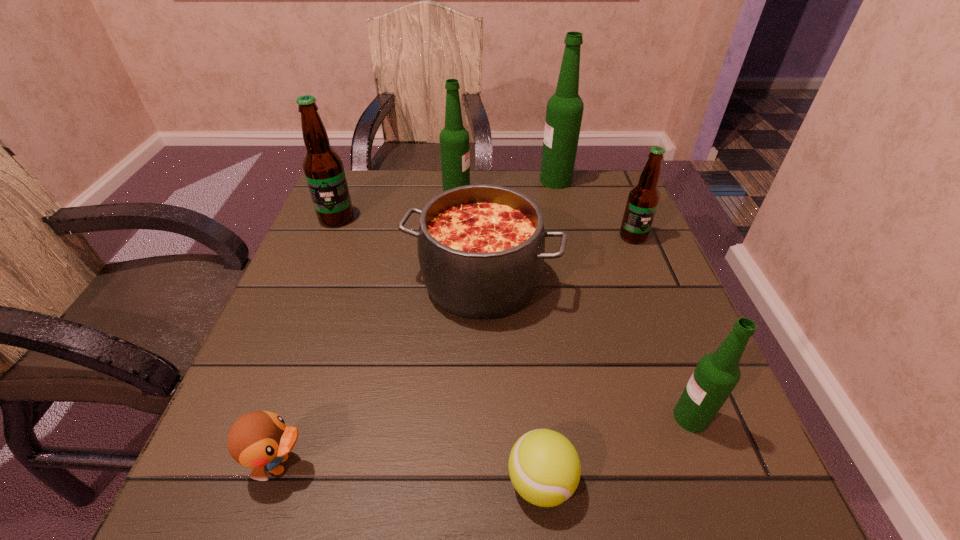
This screenshot has width=960, height=540. Find the location of `vacant space located 0.330m on the label of the third nearest object`. vacant space located 0.330m on the label of the third nearest object is located at coordinates (467, 417).

Image resolution: width=960 pixels, height=540 pixels. In order to click on blank space located 0.210m on the label of the third nearest object in this screenshot , I will do `click(542, 417)`.

The image size is (960, 540). Identify the location of vacant space located on the label of the third nearest object. (561, 417).

Find the location of a particular element. The width and height of the screenshot is (960, 540). free space located on the label of the smaller brown beer bottle is located at coordinates (660, 305).

You are a GUI agent. You are given a task and a screenshot of the screen. Output one action in this format:
    pyautogui.click(x=<x>, y=<y>)
    Task: Click on the vacant region located 0.330m on the back of the gray casserole
    This screenshot has width=960, height=540.
    Given the screenshot: What is the action you would take?
    pyautogui.click(x=481, y=173)

The height and width of the screenshot is (540, 960). Find the location of `vacant space located on the front-facing side of the seventh tallest object`. vacant space located on the front-facing side of the seventh tallest object is located at coordinates (558, 464).

You are a GUI agent. You are given a task and a screenshot of the screen. Output one action in this format:
    pyautogui.click(x=<x>, y=<y>)
    Task: Click on the free space located on the right of the tennis ball
    The height and width of the screenshot is (540, 960).
    Given the screenshot: What is the action you would take?
    pyautogui.click(x=743, y=482)

You are a GUI agent. You are given a task and a screenshot of the screen. Output one action in this format:
    pyautogui.click(x=<x>, y=<y>)
    Task: Click on the duck situated at the near edge
    The image size is (960, 540).
    Given the screenshot: What is the action you would take?
    pyautogui.click(x=260, y=440)

Image resolution: width=960 pixels, height=540 pixels. What are the coordinates of `tennis ball that is at the near edge` in the screenshot? It's located at (544, 467).

Where is `beer bottle that is at the left edge`? This screenshot has height=540, width=960. beer bottle that is at the left edge is located at coordinates (323, 168).